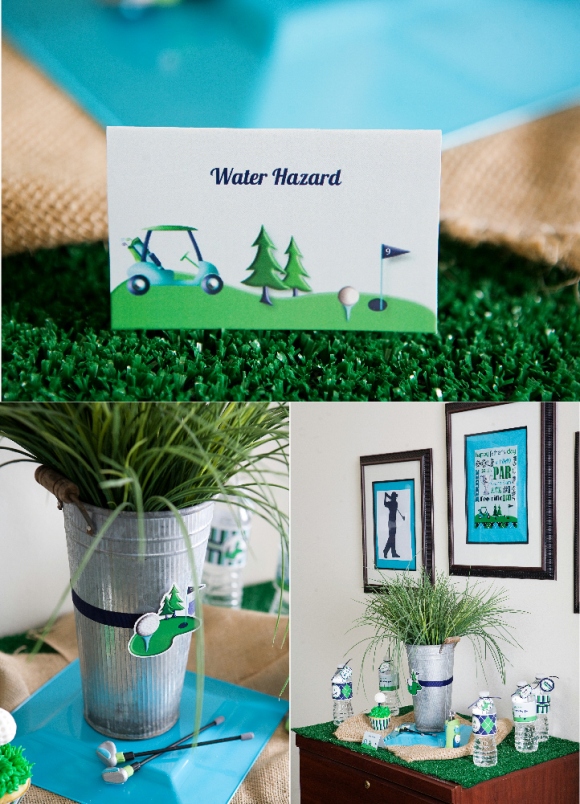
Locate an element on the screen. The height and width of the screenshot is (804, 580). tin vase is located at coordinates (135, 576), (445, 666).